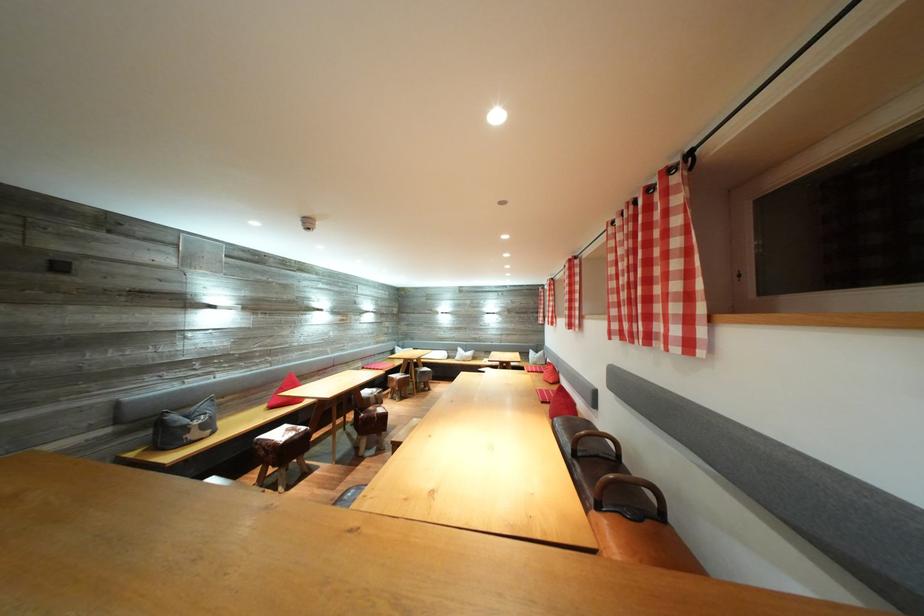
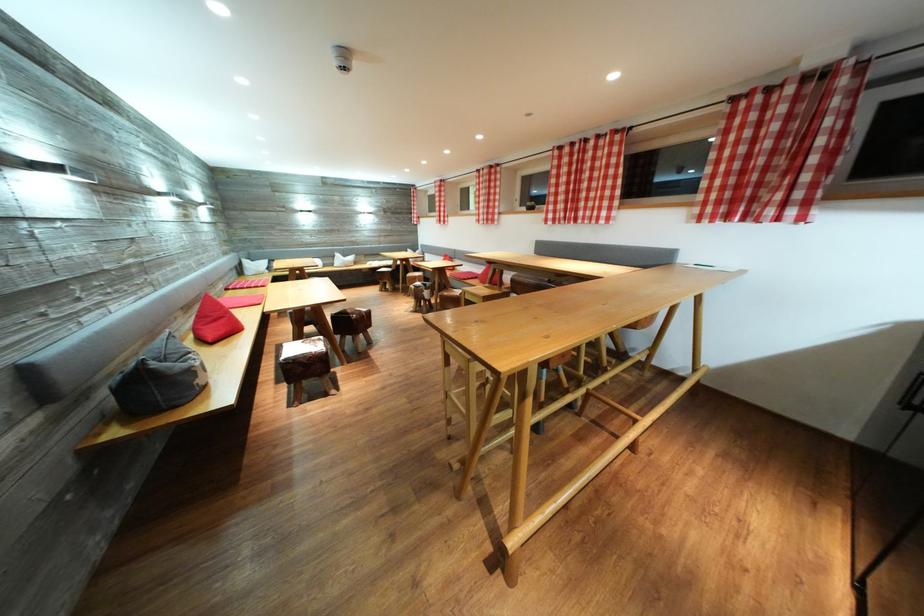
Where in the second image is the point corresponding to point 192,427 from the first image?

(187, 371)